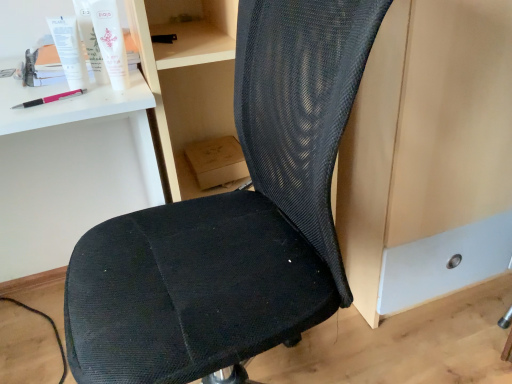
At what (x,y) coordinates should I click in order to perform the action: click on free space behind pink plastic pen at upper left. Please return your answer as a coordinate pair (x, y). This screenshot has height=384, width=512. Looking at the image, I should click on (66, 82).